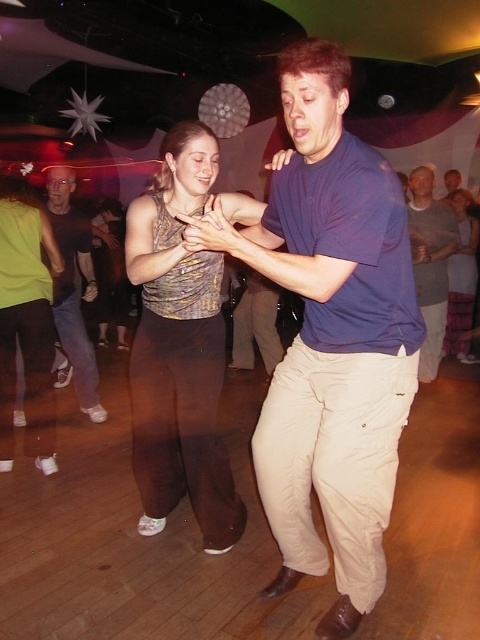
You are standing in the dance hall and want to move towards the two points marked in the image. Which point, point [454,221] or point [265,364], will you reach first?

Point [454,221] is closer to the viewer than point [265,364], so you will reach point [454,221] first.

You are a photographer at the event and want to capture a photo of the matte gold tank top at center and khaki pants at center. The camera you have can focus on objects within a 5 feet range. Will both items be in focus?

The matte gold tank top at center is 6.16 feet from khaki pants at center. Since the camera can only focus within 5 feet, the distance between them exceeds the focus range. Therefore, both items won

You are standing in the dance hall and see two points marked in the image. Which point is closer to you, point (126, 305) or point (240, 320)?

Point (126, 305) is closer to you because it is further to the viewer than point (240, 320).